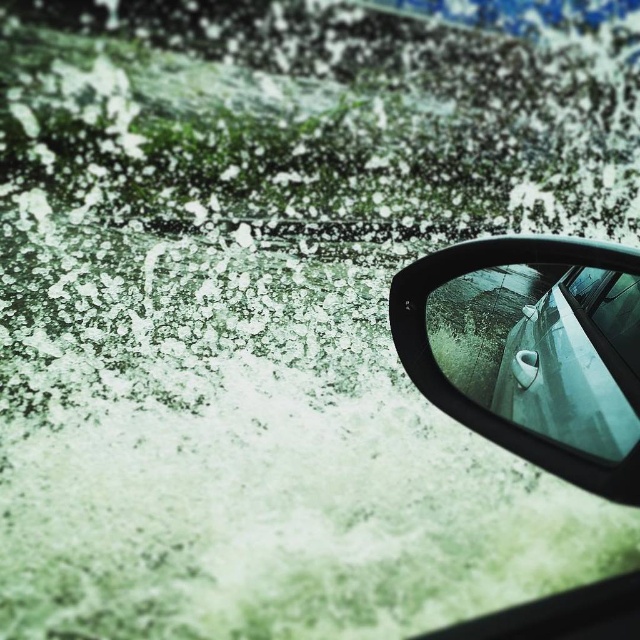
You are a driver trying to clear the ice from your windshield. You notice a point at coordinates (531, 349). Is this point located on the black glossy car mirror at upper right or on the windshield?

The point at coordinates (531, 349) is located on the black glossy car mirror at upper right according to the description.

You are a mechanic assessing the car for winter damage. The black glossy car mirror at upper right and the clear glass car window at center are both covered in ice. Which object has a greater width?

The black glossy car mirror at upper right has a greater width than the clear glass car window at center according to the description.